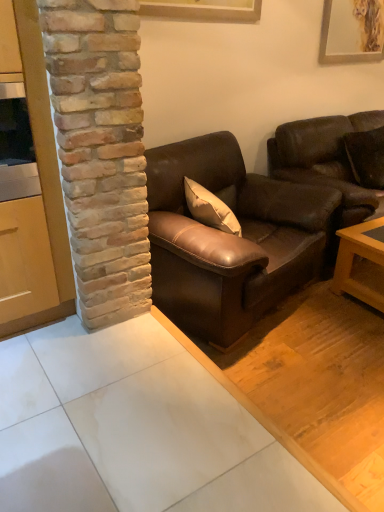
Question: Is brown leather couch at center, the first studio couch from the left, to the left of wooden cabinet at left from the viewer's perspective?

Choices:
 (A) no
 (B) yes

Answer: (A)

Question: Considering the relative sizes of brown leather couch at center, the first studio couch from the left, and wooden cabinet at left in the image provided, is brown leather couch at center, the first studio couch from the left, smaller than wooden cabinet at left?

Choices:
 (A) yes
 (B) no

Answer: (B)

Question: Is brown leather couch at center, which ranks as the second studio couch in right-to-left order, looking in the opposite direction of wooden cabinet at left?

Choices:
 (A) no
 (B) yes

Answer: (A)

Question: From the image's perspective, is brown leather couch at center, which ranks as the second studio couch in right-to-left order, located beneath wooden cabinet at left?

Choices:
 (A) no
 (B) yes

Answer: (B)

Question: From the image's perspective, is brown leather couch at center, the first studio couch from the left, above wooden cabinet at left?

Choices:
 (A) no
 (B) yes

Answer: (A)

Question: From the image's perspective, relative to brown leather couch at right, marked as the first studio couch in a right-to-left arrangement, is wooden picture frame at upper center, positioned as the 2th picture frame in right-to-left order, above or below?

Choices:
 (A) above
 (B) below

Answer: (A)

Question: In the image, is wooden picture frame at upper center, positioned as the 2th picture frame in right-to-left order, positioned in front of or behind brown leather couch at right, marked as the first studio couch in a right-to-left arrangement?

Choices:
 (A) front
 (B) behind

Answer: (A)

Question: Does point (236, 10) appear closer or farther from the camera than point (326, 175)?

Choices:
 (A) farther
 (B) closer

Answer: (B)

Question: Is wooden picture frame at upper center, which ranks as the first picture frame in left-to-right order, bigger or smaller than brown leather couch at right, marked as the first studio couch in a right-to-left arrangement?

Choices:
 (A) small
 (B) big

Answer: (A)

Question: Considering the positions of brown leather couch at right, the second studio couch when ordered from left to right, and light brown wooden table at lower right in the image, is brown leather couch at right, the second studio couch when ordered from left to right, wider or thinner than light brown wooden table at lower right?

Choices:
 (A) wide
 (B) thin

Answer: (A)

Question: Is brown leather couch at right, marked as the first studio couch in a right-to-left arrangement, inside or outside of light brown wooden table at lower right?

Choices:
 (A) outside
 (B) inside

Answer: (A)

Question: From a real-world perspective, is brown leather couch at right, the second studio couch when ordered from left to right, above or below light brown wooden table at lower right?

Choices:
 (A) below
 (B) above

Answer: (B)

Question: Is point (322, 138) closer or farther from the camera than point (357, 280)?

Choices:
 (A) farther
 (B) closer

Answer: (A)

Question: In terms of height, does wooden cabinet at left look taller or shorter compared to wooden picture frame at upper center, which is the 1th picture frame from front to back?

Choices:
 (A) tall
 (B) short

Answer: (A)

Question: Choose the correct answer: Is wooden cabinet at left inside wooden picture frame at upper center, which ranks as the first picture frame in left-to-right order, or outside it?

Choices:
 (A) outside
 (B) inside

Answer: (A)